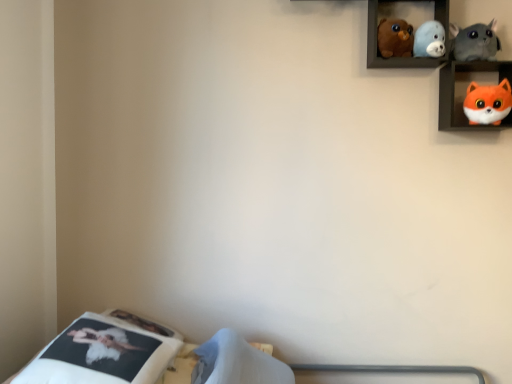
Question: Is brown plush toy at upper center, which is the 4th toy in right-to-left order, taller or shorter than fluffy orange plush at upper right, which is counted as the first toy, starting from the right?

Choices:
 (A) short
 (B) tall

Answer: (A)

Question: From a real-world perspective, is brown plush toy at upper center, which is counted as the first toy, starting from the left, above or below fluffy orange plush at upper right, which is the 4th toy from left to right?

Choices:
 (A) below
 (B) above

Answer: (B)

Question: Which is nearer to the white fabric mattress at lower left?

Choices:
 (A) brown plush toy at upper center, which is the 4th toy in right-to-left order
 (B) fluffy orange plush at upper right, which is the 4th toy from left to right
 (C) soft plush seal at upper center, positioned as the third toy in right-to-left order
 (D) orange plush toy at upper right, which is the second shelf from left to right
 (E) fluffy gray cat at upper right, marked as the 3th toy in a left-to-right arrangement

Answer: (A)

Question: Considering the real-world distances, which object is farthest from the fluffy orange plush at upper right, which is counted as the first toy, starting from the right?

Choices:
 (A) soft plush toys at upper center, placed as the second shelf when sorted from right to left
 (B) fluffy gray cat at upper right, marked as the 3th toy in a left-to-right arrangement
 (C) brown plush toy at upper center, which is the 4th toy in right-to-left order
 (D) orange plush toy at upper right, which is the second shelf from left to right
 (E) soft plush seal at upper center, which is the second toy from left to right

Answer: (C)